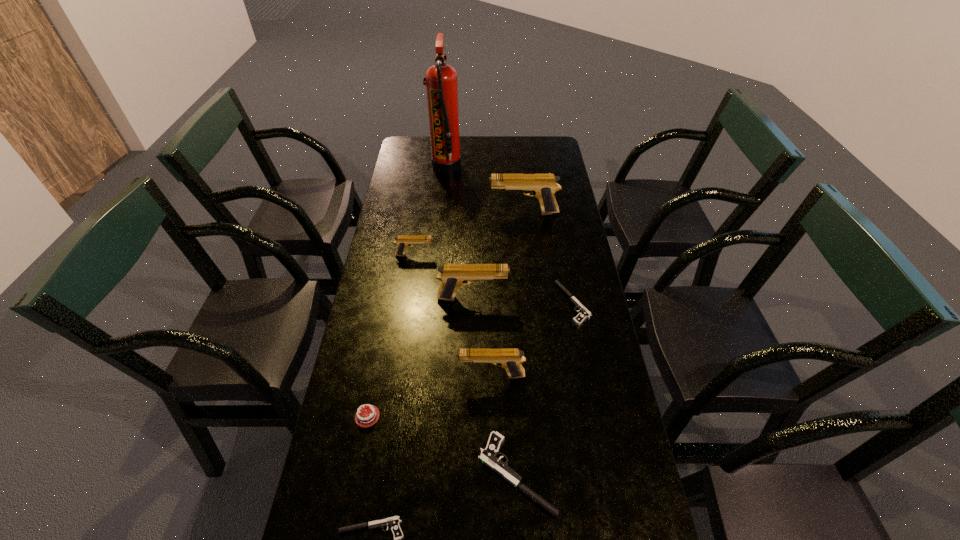
Identify which tan pistol is located as the second nearest to the sixth tallest object. Please provide its 2D coordinates. Your answer should be formatted as a tuple, i.e. [(x, y)], where the tuple contains the x and y coordinates of a point satisfying the conditions above.

[(453, 276)]

This screenshot has height=540, width=960. Find the location of `tan pistol that stands as the fourth closest to the second biggest black pistol`. tan pistol that stands as the fourth closest to the second biggest black pistol is located at coordinates (402, 241).

Identify which black pistol is the second closest to the rightmost black pistol. Please provide its 2D coordinates. Your answer should be formatted as a tuple, i.e. [(x, y)], where the tuple contains the x and y coordinates of a point satisfying the conditions above.

[(393, 522)]

Locate which black pistol is the third closest to the nearest tan pistol. Please provide its 2D coordinates. Your answer should be formatted as a tuple, i.e. [(x, y)], where the tuple contains the x and y coordinates of a point satisfying the conditions above.

[(393, 522)]

Identify the location of free space that satisfies the following two spatial constraints: 1. at the barrel of the farthest tan pistol; 2. on the front side of the red chocolate cake. The width and height of the screenshot is (960, 540). click(x=546, y=416).